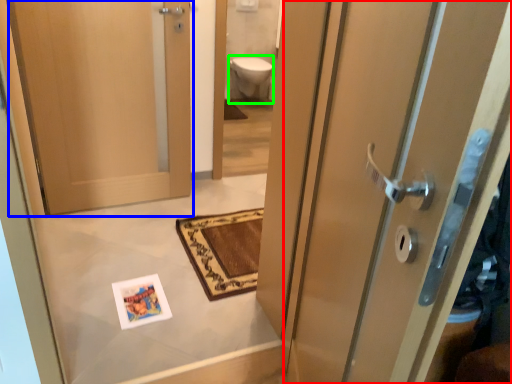
Question: Which is farther away from door (highlighted by a red box)? door (highlighted by a blue box) or toilet bowl (highlighted by a green box)?

Choices:
 (A) door
 (B) toilet bowl

Answer: (B)